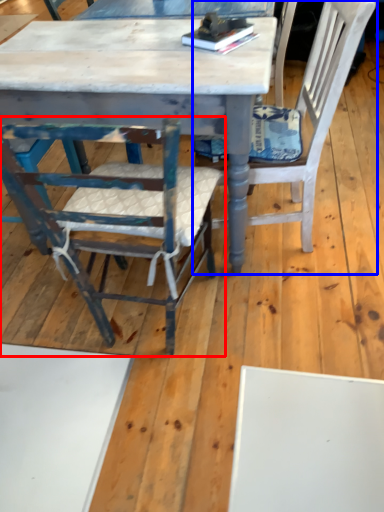
Question: Among these objects, which one is farthest to the camera, chair (highlighted by a red box) or chair (highlighted by a blue box)?

Choices:
 (A) chair
 (B) chair

Answer: (B)